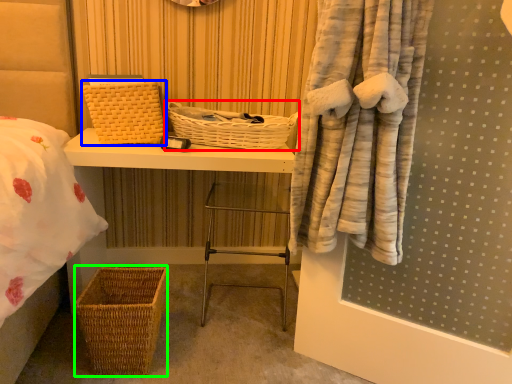
Question: Which object is positioned closest to basket (highlighted by a red box)? Select from basket (highlighted by a blue box) and basket (highlighted by a green box).

Choices:
 (A) basket
 (B) basket

Answer: (A)